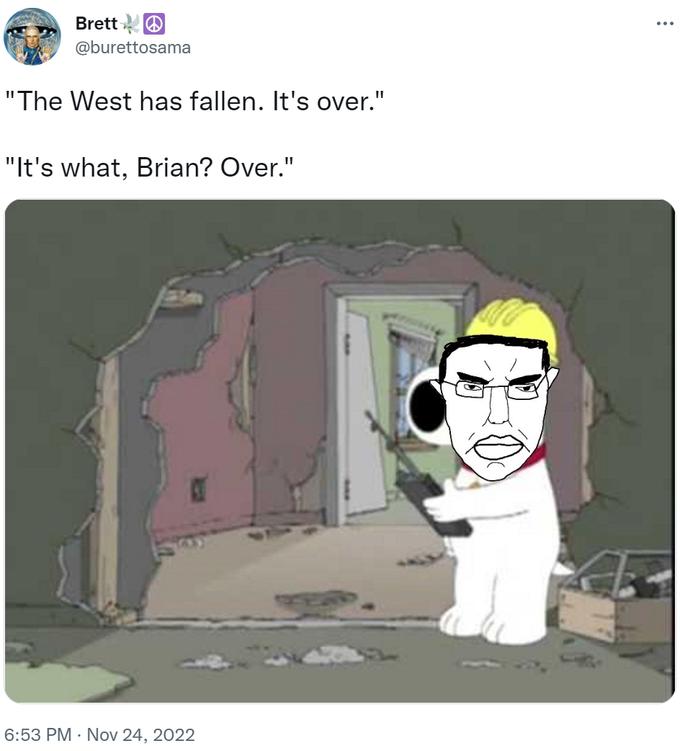
You are a GUI agent. You are given a task and a screenshot of the screen. Output one action in this format:
    pyautogui.click(x=<x>, y=<y>)
    Task: Click on the interior wall support beams
    The height and width of the screenshot is (751, 680).
    Given the screenshot: What is the action you would take?
    pyautogui.click(x=112, y=453), pyautogui.click(x=184, y=300), pyautogui.click(x=588, y=394)